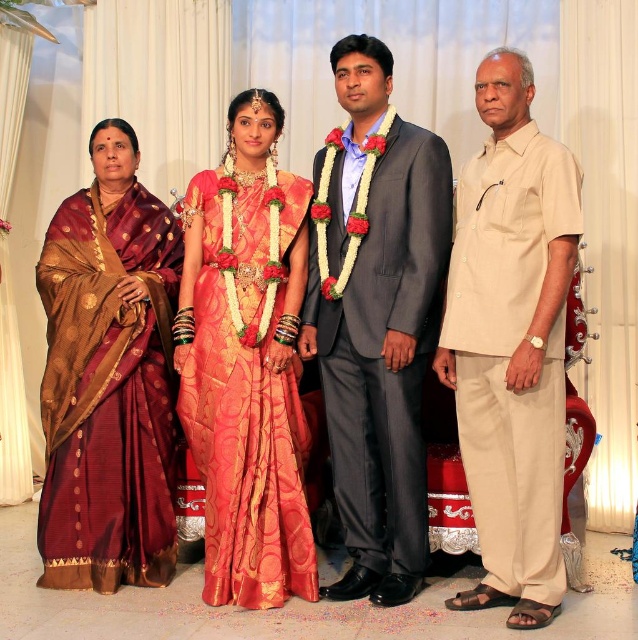
You are a photographer standing at the camera position in the scene. You want to adjust your position so that the matte gray suit at center is exactly 10 feet away from you. Should you move closer or farther away?

The matte gray suit at center is currently 9.83 feet away from the camera. To make it exactly 10 feet away, you should move slightly farther away from the matte gray suit at center.

You are a photographer arranging a group photo for a traditional Indian wedding. You have two key outfits to position in the frame. The matte gray suit at center and the maroon silk saree at left. Considering the space they occupy, which outfit takes up more horizontal space in the image?

The matte gray suit at center takes up more horizontal space in the image because its width is larger than the maroon silk saree at left.

You are standing at the point closest to the front of the image. There are two points marked in the image, one at coordinate point (352, 186) and another at point (486, 488). Which of these points is farther away from you?

Point (352, 186) is behind point (486, 488), so it is farther away from you.